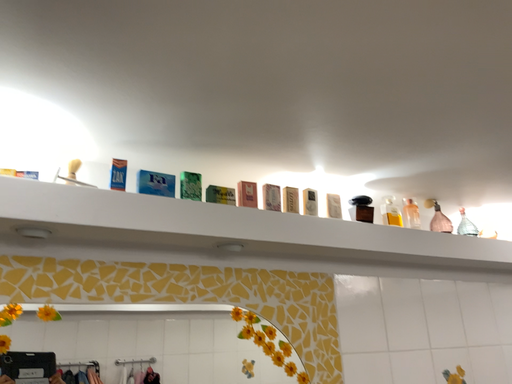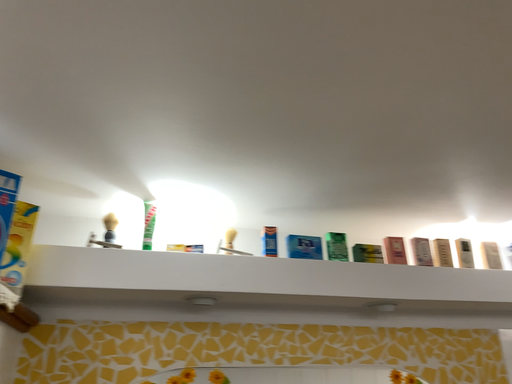
Question: Which way did the camera rotate in the video?

Choices:
 (A) rotated right
 (B) rotated left

Answer: (B)